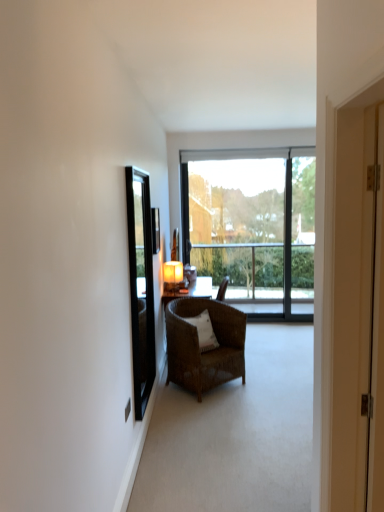
At what (x,y) coordinates should I click in order to perform the action: click on clear glass mirror at left. Please return your answer as a coordinate pair (x, y). Looking at the image, I should click on coord(141,286).

What is the approximate height of white woven pillow at center?

12.61 inches.

Identify the location of matte yellow lampshade at center. Image resolution: width=384 pixels, height=512 pixels. (173, 276).

Considering the relative sizes of clear glass mirror at left and white wooden door at right in the image provided, is clear glass mirror at left thinner than white wooden door at right?

Correct, the width of clear glass mirror at left is less than that of white wooden door at right.

Between clear glass mirror at left and white wooden door at right, which one appears on the right side from the viewer's perspective?

white wooden door at right is more to the right.

From the image's perspective, is clear glass mirror at left under white wooden door at right?

No.

Relative to white wooden door at right, is clear glass mirror at left in front or behind?

In the image, clear glass mirror at left appears behind white wooden door at right.

From a real-world perspective, between transparent glass window at center and white wooden door at right, who is vertically lower?

transparent glass window at center.

Which object is wider, transparent glass window at center or white wooden door at right?

With larger width is white wooden door at right.

Considering the relative positions of transparent glass window at center and white wooden door at right in the image provided, is transparent glass window at center behind white wooden door at right?

Yes, transparent glass window at center is further from the viewer.

From the image's perspective, does transparent glass window at center appear lower than white wooden door at right?

Incorrect, from the image's perspective, transparent glass window at center is higher than white wooden door at right.

Is woven brown chair at center turned away from white woven pillow at center?

Yes.

Relative to white woven pillow at center, is woven brown chair at center in front or behind?

Clearly, woven brown chair at center is in front of white woven pillow at center.

From a real-world perspective, does woven brown chair at center stand above white woven pillow at center?

No, from a real-world perspective, woven brown chair at center is not on top of white woven pillow at center.

Is woven brown chair at center wider than white woven pillow at center?

Yes, woven brown chair at center is wider than white woven pillow at center.

Which object is wider, clear glass mirror at left or white woven pillow at center?

Wider between the two is white woven pillow at center.

From the image's perspective, would you say clear glass mirror at left is positioned over white woven pillow at center?

Yes, from the image's perspective, clear glass mirror at left is above white woven pillow at center.

Is white woven pillow at center at the back of clear glass mirror at left?

No, white woven pillow at center is not at the back of clear glass mirror at left.

Is clear glass mirror at left at the left side of white woven pillow at center?

Yes, clear glass mirror at left is to the left of white woven pillow at center.

Locate an element on the screen. The width and height of the screenshot is (384, 512). window screen on the left side of transparent glass window at center is located at coordinates (141, 286).

Which is behind, clear glass mirror at left or transparent glass window at center?

transparent glass window at center is behind.

From the image's perspective, is clear glass mirror at left located above transparent glass window at center?

No, from the image's perspective, clear glass mirror at left is not over transparent glass window at center.

Between clear glass mirror at left and transparent glass window at center, which one has larger size?

transparent glass window at center.

Which is in front, point (196, 344) or point (367, 98)?

Point (367, 98)

How much distance is there between woven brown chair at center and white wooden door at right?

A distance of 2.50 meters exists between woven brown chair at center and white wooden door at right.

Is there a large distance between woven brown chair at center and white wooden door at right?

Yes, woven brown chair at center is far from white wooden door at right.

Find the location of a particular element. The image size is (384, 512). chair behind the white wooden door at right is located at coordinates (198, 345).

Between matte yellow lampshade at center and matte black screen door at right, which one has smaller width?

Thinner between the two is matte black screen door at right.

Is matte yellow lampshade at center next to matte black screen door at right?

matte yellow lampshade at center and matte black screen door at right are clearly separated.

From a real-world perspective, between matte yellow lampshade at center and matte black screen door at right, who is vertically higher?

matte black screen door at right, from a real-world perspective.

Is matte black screen door at right located within matte yellow lampshade at center?

No, matte black screen door at right is not inside matte yellow lampshade at center.

Where is `door on the right of the clear glass mirror at left`? door on the right of the clear glass mirror at left is located at coordinates (356, 293).

Locate an element on the screen. The height and width of the screenshot is (512, 384). window behind the white wooden door at right is located at coordinates (253, 226).

Estimate the real-world distances between objects in this image. Which object is closer to white wooden door at right, matte black screen door at right or woven brown chair at center?

The object closer to white wooden door at right is matte black screen door at right.

Estimate the real-world distances between objects in this image. Which object is further from clear glass mirror at left, transparent glass window at center or matte yellow lampshade at center?

transparent glass window at center lies further to clear glass mirror at left than the other object.

Based on their spatial positions, is clear glass mirror at left or matte yellow lampshade at center further from woven brown chair at center?

matte yellow lampshade at center is further to woven brown chair at center.

Estimate the real-world distances between objects in this image. Which object is closer to clear glass mirror at left, woven brown chair at center or matte black screen door at right?

woven brown chair at center.

Looking at the image, which one is located closer to woven brown chair at center, clear glass mirror at left or matte black screen door at right?

clear glass mirror at left.

Considering their positions, is matte black screen door at right positioned closer to white woven pillow at center than white wooden door at right?

white wooden door at right.

Looking at the image, which one is located closer to matte yellow lampshade at center, clear glass mirror at left or woven brown chair at center?

woven brown chair at center is closer to matte yellow lampshade at center.

When comparing their distances from matte black screen door at right, does white woven pillow at center or matte yellow lampshade at center seem further?

matte yellow lampshade at center lies further to matte black screen door at right than the other object.

Locate an element on the screen. The width and height of the screenshot is (384, 512). window screen positioned between matte black screen door at right and white woven pillow at center from near to far is located at coordinates (141, 286).

Locate an element on the screen. pillow between matte black screen door at right and transparent glass window at center in the front-back direction is located at coordinates (204, 331).

Locate an element on the screen. This screenshot has width=384, height=512. chair positioned between matte black screen door at right and transparent glass window at center from near to far is located at coordinates (198, 345).

Locate an element on the screen. The image size is (384, 512). window screen located between white wooden door at right and woven brown chair at center in the depth direction is located at coordinates (141, 286).